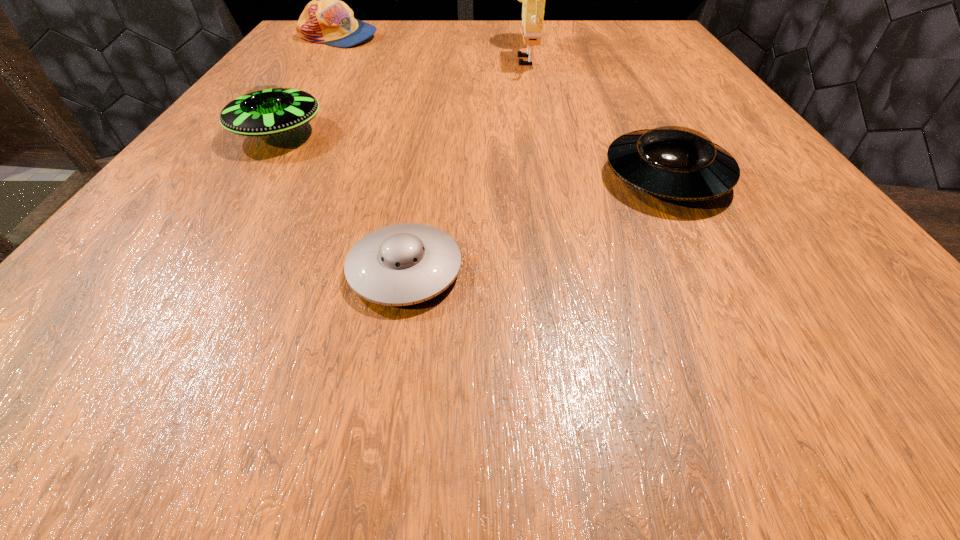
Locate an element on the screen. This screenshot has height=540, width=960. the fourth object from left to right is located at coordinates (533, 0).

At what (x,y) coordinates should I click in order to perform the action: click on the tallest object. Please return your answer as a coordinate pair (x, y). This screenshot has width=960, height=540. Looking at the image, I should click on (533, 0).

What are the coordinates of `cap` in the screenshot? It's located at (326, 19).

Identify the location of the leftmost saucer. 265,110.

Where is `the second shortest saucer`? The image size is (960, 540). the second shortest saucer is located at coordinates (673, 162).

Image resolution: width=960 pixels, height=540 pixels. I want to click on the second shortest object, so click(x=673, y=162).

The height and width of the screenshot is (540, 960). I want to click on the nearest object, so click(403, 264).

Locate an element on the screen. Image resolution: width=960 pixels, height=540 pixels. the shortest object is located at coordinates (403, 264).

Locate an element on the screen. The height and width of the screenshot is (540, 960). vacant area situated 0.060m on the front-facing side of the fourth object from left to right is located at coordinates (476, 54).

Locate an element on the screen. The height and width of the screenshot is (540, 960). free space located on the front-facing side of the fourth object from left to right is located at coordinates (419, 54).